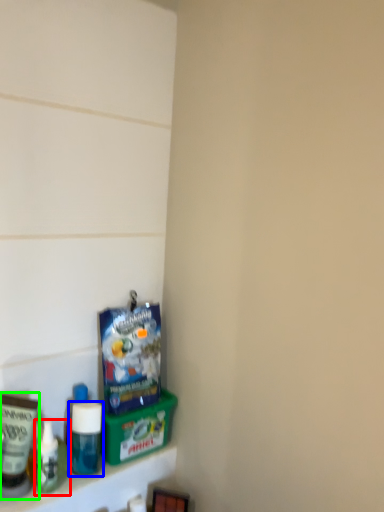
Question: Which object is the closest to the toiletry (highlighted by a red box)? Choose among these: bottle (highlighted by a blue box) or toiletry (highlighted by a green box).

Choices:
 (A) bottle
 (B) toiletry

Answer: (B)